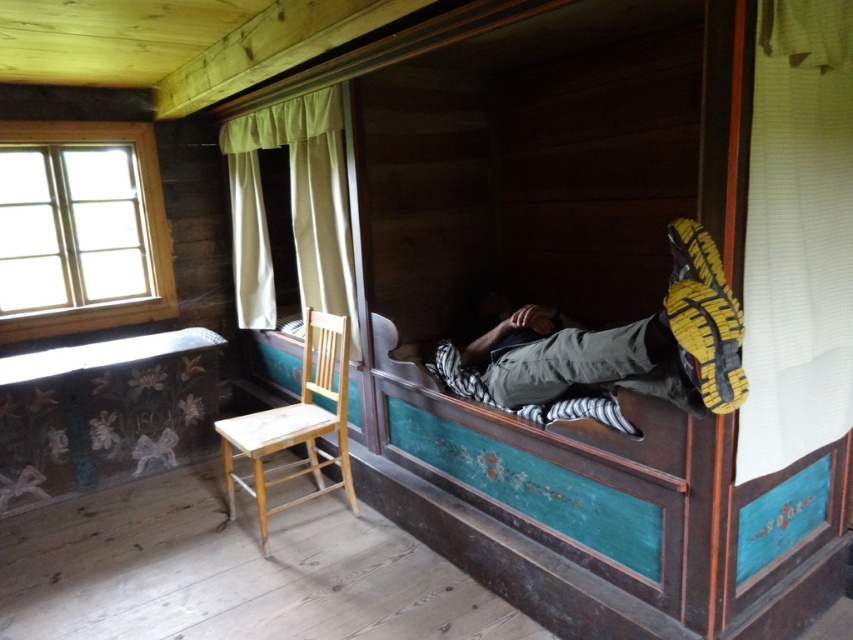
You are standing in the cabin and want to know where the green fabric curtain at upper center is located. Which object is closest to the point marked by coordinates point (292,209)?

The green fabric curtain at upper center is located at point (292,209).

You are trying to decide whether to place the gray fabric pants at center on top of the light brown wooden chair at left. Based on their sizes, is this a feasible arrangement?

The gray fabric pants at center is thinner than the light brown wooden chair at left, so it is feasible to place the gray fabric pants at center on top of the light brown wooden chair at left as it can accommodate the smaller width.

You are inside the rustic wooden cabin and want to know if the green fabric curtain at upper center is hanging above or below the clear glass window at upper left. Based on the scene description, can you determine its position?

The green fabric curtain at upper center is positioned under the clear glass window at upper left, meaning it is hanging below the window.